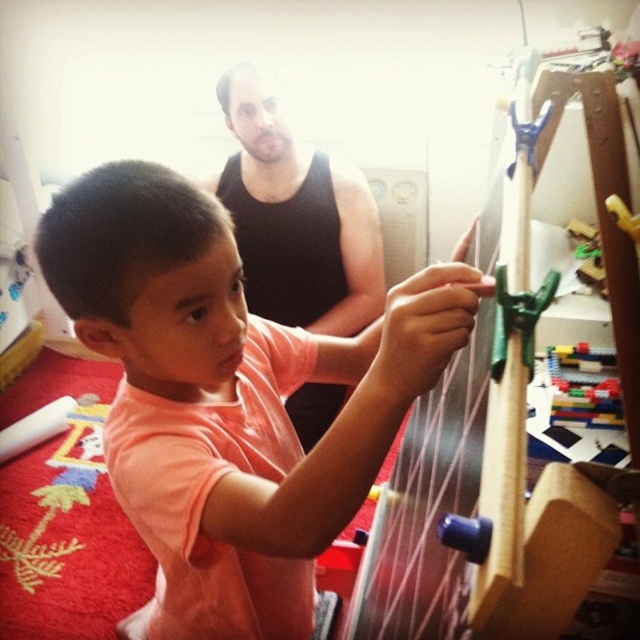
You are a toy organizer in the playroom. You need to place a new toy box between the pink matte shirt at center and the translucent plastic blocks at upper right. Can you fit the toy box there?

The pink matte shirt at center is located below the translucent plastic blocks at upper right, so there is space between them to place the toy box.

You are a toy designer who wants to create a new set that includes both the black tank top at upper center and the translucent plastic blocks at upper right. Based on their sizes, which object should be placed in a larger storage container?

The black tank top at upper center is much taller than the translucent plastic blocks at upper right, so the larger storage container should be used for the black tank top at upper center.

You are a photographer setting up for a family photo in the playroom. You need to position a light source so it illuminates both the pink matte shirt at center and the black tank top at upper center. Given their heights, which object should the light be angled higher to reach?

The light should be angled higher to reach the black tank top at upper center because it is taller than the pink matte shirt at center.